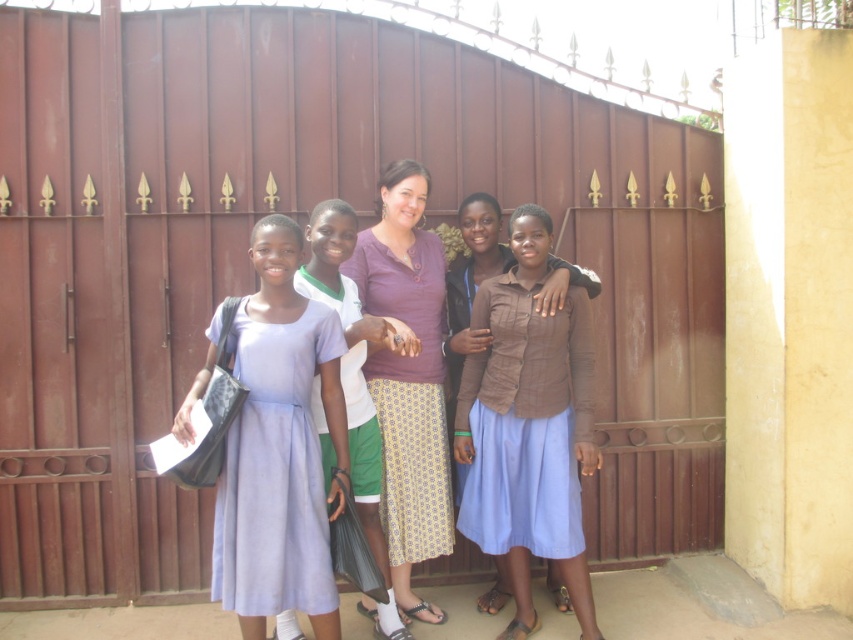
Measure the distance from brown textured shirt at center to purple textured shirt at center.

The distance of brown textured shirt at center from purple textured shirt at center is 69.61 centimeters.

Can you confirm if brown textured shirt at center is positioned to the left of purple textured shirt at center?

In fact, brown textured shirt at center is to the right of purple textured shirt at center.

The image size is (853, 640). I want to click on brown textured shirt at center, so click(x=527, y=428).

Find the location of a particular element. This screenshot has height=640, width=853. brown textured shirt at center is located at coordinates (527, 428).

Who is positioned more to the left, purple cotton shirt at center or purple textured shirt at center?

Positioned to the left is purple textured shirt at center.

In the scene shown: Can you confirm if purple cotton shirt at center is taller than purple textured shirt at center?

Yes.

You are a GUI agent. You are given a task and a screenshot of the screen. Output one action in this format:
    pyautogui.click(x=<x>, y=<y>)
    Task: Click on the purple cotton shirt at center
    
    Given the screenshot: What is the action you would take?
    pyautogui.click(x=407, y=378)

Locate an element on the screen. purple cotton shirt at center is located at coordinates (407, 378).

Between lavender satin dress at center and purple cotton shirt at center, which one is positioned lower?

lavender satin dress at center

Is lavender satin dress at center in front of purple cotton shirt at center?

Yes.

This screenshot has height=640, width=853. Find the location of `lavender satin dress at center`. lavender satin dress at center is located at coordinates (276, 470).